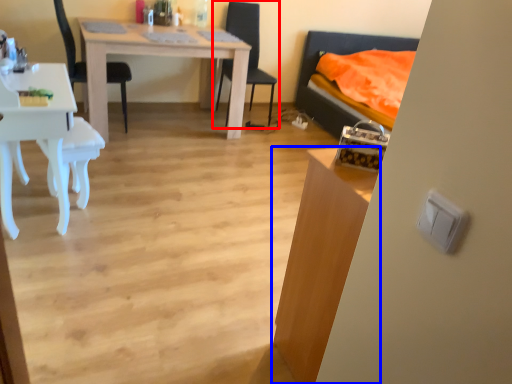
Question: Which of the following is the closest to the observer, chair (highlighted by a red box) or table (highlighted by a blue box)?

Choices:
 (A) chair
 (B) table

Answer: (B)